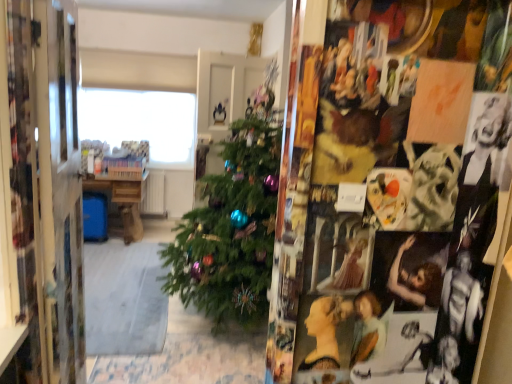
Question: Looking at the image, does wooden table at center seem bigger or smaller compared to metallic silver mirror at left?

Choices:
 (A) big
 (B) small

Answer: (B)

Question: Is wooden table at center to the left or to the right of metallic silver mirror at left in the image?

Choices:
 (A) left
 (B) right

Answer: (A)

Question: Estimate the real-world distances between objects in this image. Which object is farther from the metallic silver mirror at left?

Choices:
 (A) transparent glass window at upper center
 (B) wooden table at center

Answer: (A)

Question: Which object is the closest to the wooden table at center?

Choices:
 (A) transparent glass window at upper center
 (B) metallic silver mirror at left

Answer: (A)